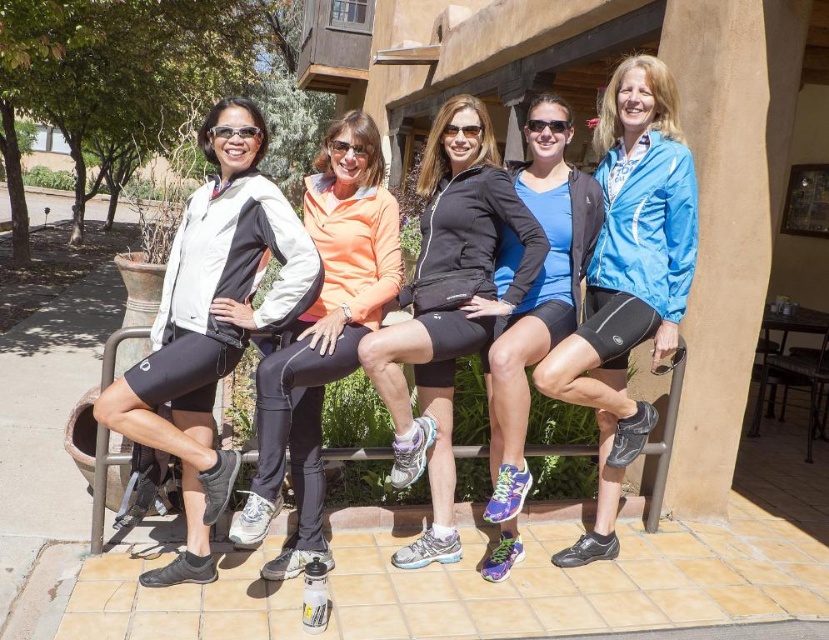
Can you confirm if matte black shorts at left is positioned to the left of blue matte shorts at center?

Indeed, matte black shorts at left is positioned on the left side of blue matte shorts at center.

Identify the location of matte black shorts at left. (211, 323).

Between blue matte jacket at center and black matte shorts at center, which one is positioned higher?

blue matte jacket at center is above.

Is blue matte jacket at center smaller than black matte shorts at center?

Incorrect, blue matte jacket at center is not smaller in size than black matte shorts at center.

Is point (618, 144) positioned behind point (473, 195)?

Yes, point (618, 144) is farther from viewer.

This screenshot has height=640, width=829. I want to click on blue matte jacket at center, so click(x=628, y=280).

Between point (217, 451) and point (550, 376), which one is positioned in front?

Point (217, 451)

Is point (199, 508) farther from viewer compared to point (679, 305)?

No, it is in front of (679, 305).

What do you see at coordinates (211, 323) in the screenshot?
I see `matte black shorts at left` at bounding box center [211, 323].

Identify the location of matte black shorts at left. (211, 323).